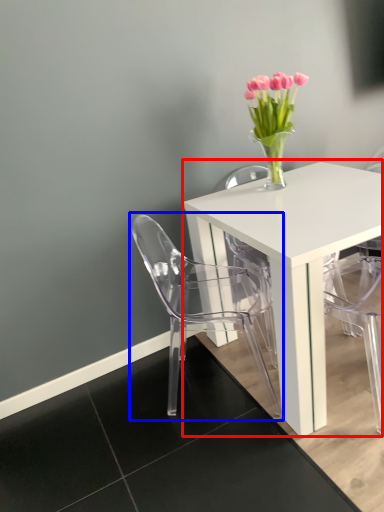
Question: Which of the following is the farthest to the observer, table (highlighted by a red box) or chair (highlighted by a blue box)?

Choices:
 (A) table
 (B) chair

Answer: (B)